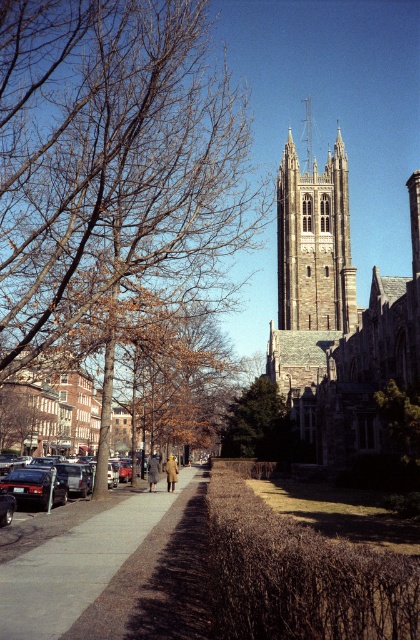
Who is higher up, green leafy tree at center or matte black sedan at left?

green leafy tree at center is higher up.

Is point (283, 432) farther from camera compared to point (71, 524)?

Yes, it is.

Image resolution: width=420 pixels, height=640 pixels. Describe the element at coordinates (259, 424) in the screenshot. I see `green leafy tree at center` at that location.

This screenshot has height=640, width=420. Identify the location of green leafy tree at center. (259, 424).

Measure the distance between dark gray stone church at center and dark brown stone tower at center.

dark gray stone church at center is 9.77 feet away from dark brown stone tower at center.

Looking at this image, is dark gray stone church at center taller than dark brown stone tower at center?

Indeed, dark gray stone church at center has a greater height compared to dark brown stone tower at center.

Measure the distance between dark gray stone church at center and camera.

The distance of dark gray stone church at center from camera is 112.90 meters.

You are a GUI agent. You are given a task and a screenshot of the screen. Output one action in this format:
    pyautogui.click(x=<x>, y=<y>)
    Task: Click on the dark gray stone church at center
    This screenshot has height=640, width=420.
    Given the screenshot: What is the action you would take?
    pyautogui.click(x=336, y=314)

Who is higher up, brown leafy tree at center-left or shiny black sedan at lower left?

brown leafy tree at center-left is higher up.

Measure the distance between point (197, 113) and camera.

Point (197, 113) and camera are 125.91 meters apart.

Who is more forward, (79, 292) or (26, 497)?

Point (26, 497) is more forward.

Find the location of `brown leafy tree at center-left`. brown leafy tree at center-left is located at coordinates (113, 168).